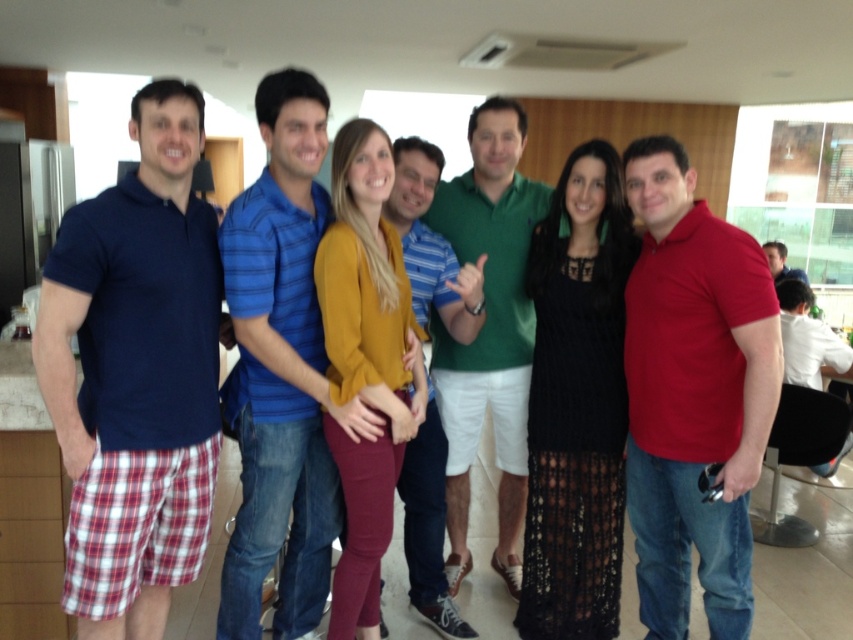
You are organizing a clothing donation drive and need to determine which of the two blue shirts at the center of the image can fit into a standard donation box that requires items to be no larger than 18 inches in any dimension. The blue striped polo shirt at center and the matte blue shirt at center are both available. Which one should you choose?

The matte blue shirt at center should be chosen because it is smaller than the blue striped polo shirt at center, making it more likely to fit within the 18 inch requirement.

You are a photographer setting up for a group photo. You need to ensure that the blue striped polo shirt at center and the matte blue shirt at center are at least 10 feet apart for proper lighting. Based on the scene, can you confirm if they meet this requirement?

The blue striped polo shirt at center and the matte blue shirt at center are 12.54 feet apart from each other, which exceeds the required 10 feet distance. Therefore, they meet the requirement for proper lighting.